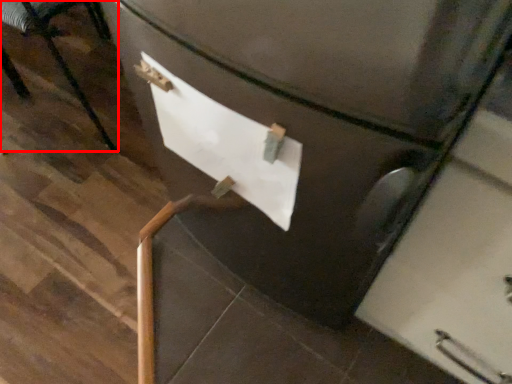
Question: From the image's perspective, what is the correct spatial positioning of furniture (annotated by the red box) in reference to paper?

Choices:
 (A) below
 (B) above

Answer: (B)